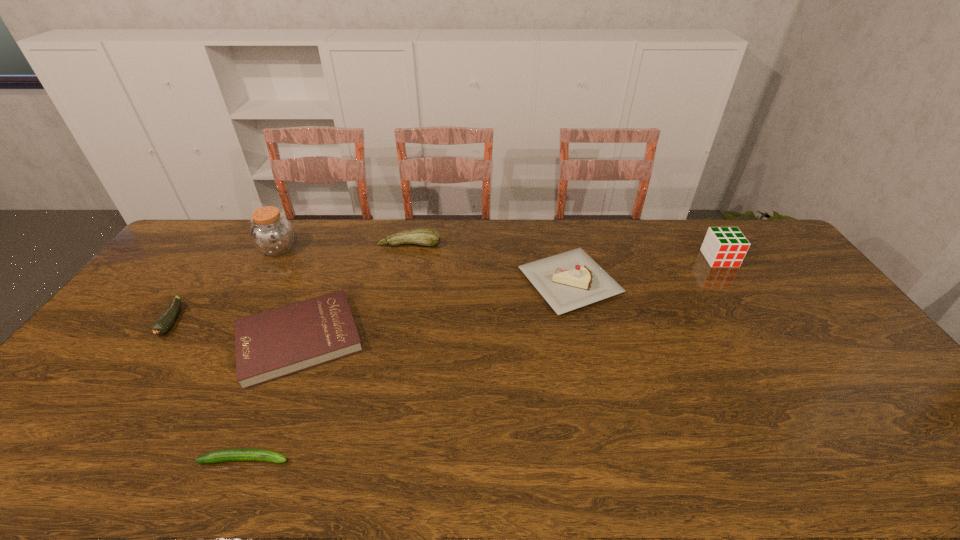
Find the location of a particular element. The image size is (960, 540). unoccupied position between the cake and the hardback book is located at coordinates coord(435,310).

The height and width of the screenshot is (540, 960). Identify the location of free space between the second tallest object and the farthest zucchini. (564, 252).

At what (x,y) coordinates should I click in order to perform the action: click on free space between the tallest object and the hardback book. Please return your answer as a coordinate pair (x, y). Looking at the image, I should click on (289, 294).

This screenshot has height=540, width=960. I want to click on vacant space that's between the cube and the jar, so click(498, 254).

Locate an element on the screen. The height and width of the screenshot is (540, 960). free area in between the hardback book and the fifth shortest object is located at coordinates (435, 310).

At what (x,y) coordinates should I click in order to perform the action: click on empty location between the second tallest zucchini and the nearest zucchini. Please return your answer as a coordinate pair (x, y). This screenshot has width=960, height=540. Looking at the image, I should click on (208, 390).

Find the location of a particular element. free space that is in between the shortest zucchini and the hardback book is located at coordinates (273, 399).

Locate an element on the screen. vacant area between the second object from right to left and the leftmost zucchini is located at coordinates (371, 302).

Locate an element on the screen. vacant space that's between the rightmost object and the sixth object from left to right is located at coordinates (644, 271).

Where is `object that stands as the fifth closest to the tallest object`? object that stands as the fifth closest to the tallest object is located at coordinates (567, 281).